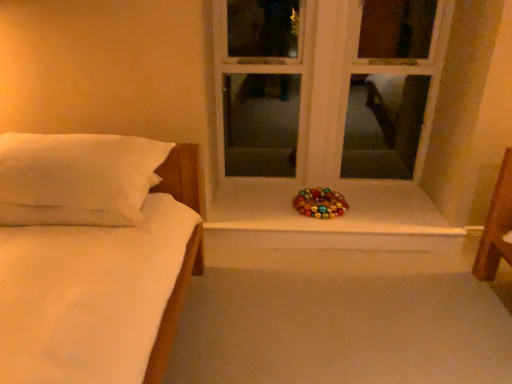
The width and height of the screenshot is (512, 384). I want to click on free location above metallic shiny wreath at center (from a real-world perspective), so click(325, 216).